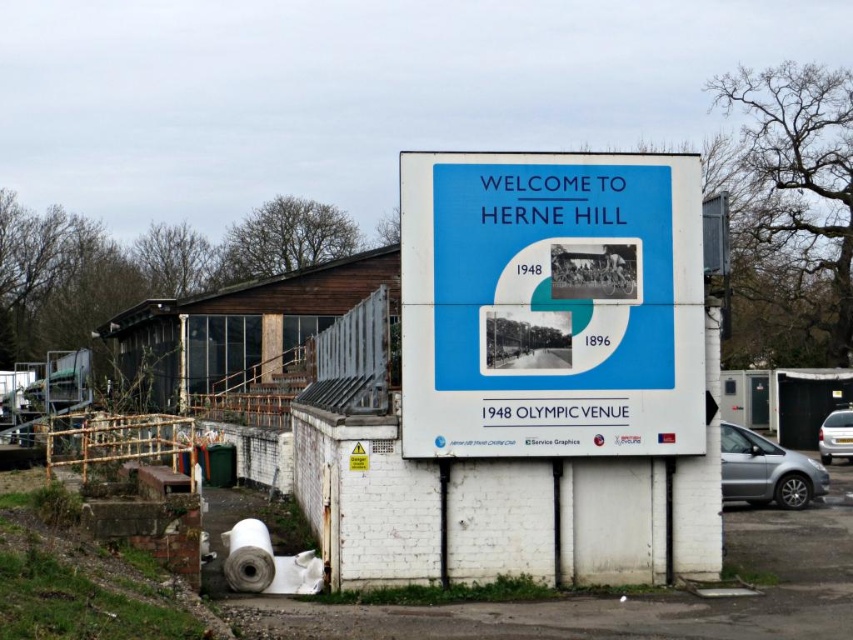
Question: From the image, what is the correct spatial relationship of blue matte signboard at center in relation to silver metallic car at right?

Choices:
 (A) right
 (B) left

Answer: (B)

Question: Which of these objects is positioned closest to the silver metallic car at right?

Choices:
 (A) silver metallic car at lower right
 (B) blue matte signboard at center

Answer: (A)

Question: Is blue matte signboard at center above silver metallic car at lower right?

Choices:
 (A) no
 (B) yes

Answer: (B)

Question: Which is farther from the silver metallic car at right?

Choices:
 (A) blue matte signboard at center
 (B) silver metallic car at lower right

Answer: (A)

Question: Which object is the closest to the silver metallic car at lower right?

Choices:
 (A) blue matte signboard at center
 (B) silver metallic car at right

Answer: (A)

Question: Is blue matte signboard at center wider than silver metallic car at right?

Choices:
 (A) no
 (B) yes

Answer: (B)